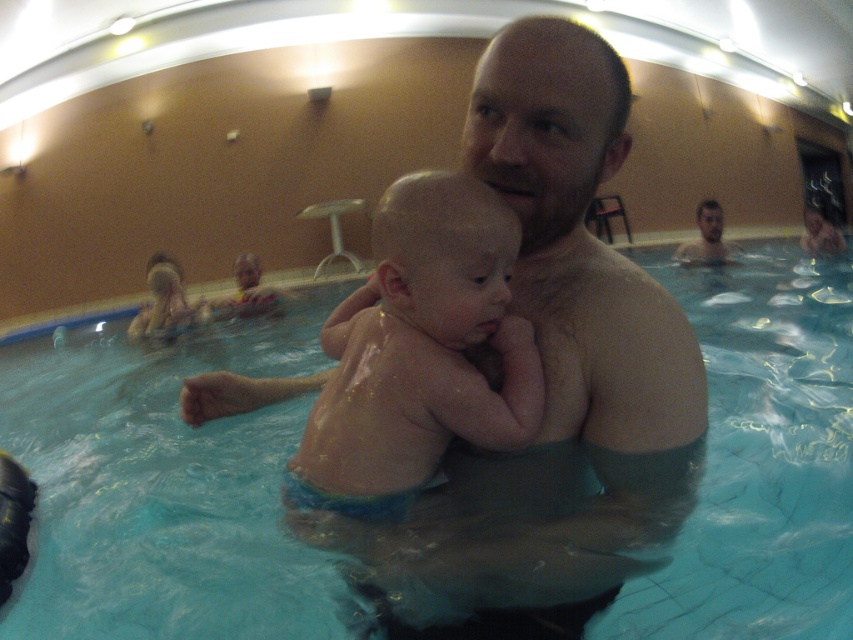
Is blue smooth water at center to the left of smooth skin man at upper right from the viewer's perspective?

Yes, blue smooth water at center is to the left of smooth skin man at upper right.

Is point (706, 529) closer to camera compared to point (718, 241)?

Yes, it is.

This screenshot has height=640, width=853. What are the coordinates of `blue smooth water at center` in the screenshot? It's located at (163, 492).

Which is above, blue smooth water at center or smooth skin man at center?

Result: smooth skin man at center

Where is `blue smooth water at center`? This screenshot has width=853, height=640. blue smooth water at center is located at coordinates (163, 492).

Image resolution: width=853 pixels, height=640 pixels. What do you see at coordinates (553, 378) in the screenshot?
I see `smooth skin man at center` at bounding box center [553, 378].

Does smooth skin man at center have a greater width compared to smooth skin baby at center?

Correct, the width of smooth skin man at center exceeds that of smooth skin baby at center.

Does point (517, 92) come farther from viewer compared to point (390, 378)?

No, it is not.

Locate an element on the screen. The image size is (853, 640). smooth skin man at center is located at coordinates (553, 378).